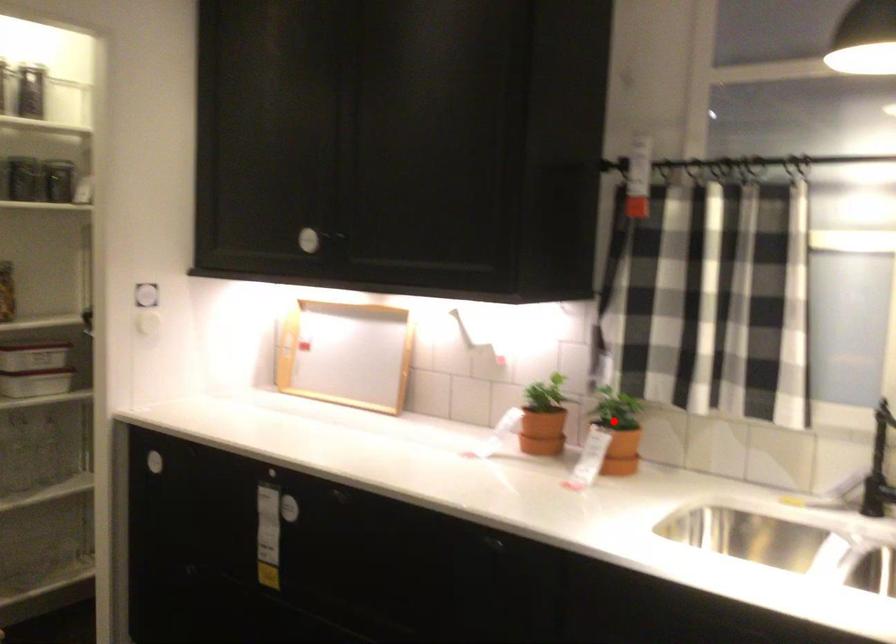
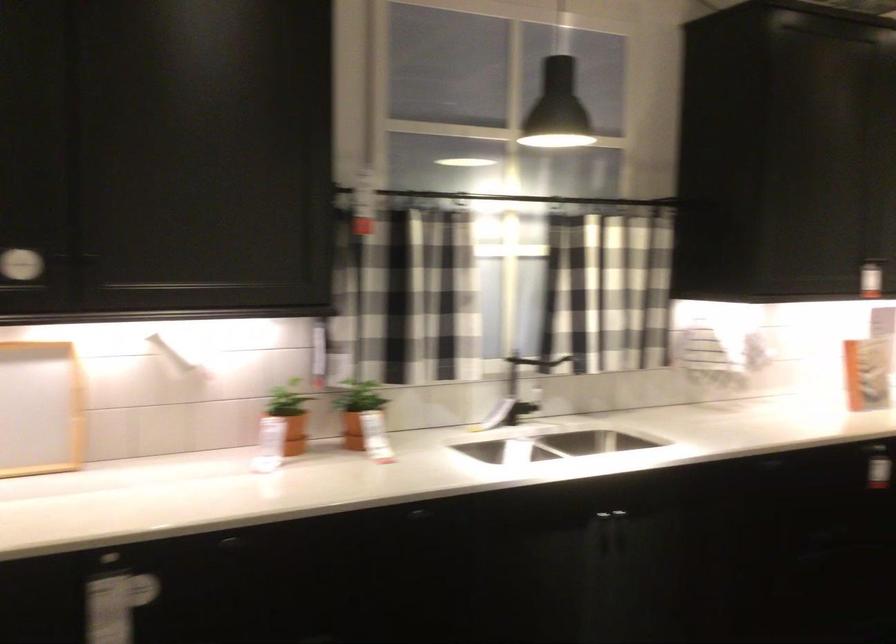
Find the pixel in the second image that matches the highlighted location in the first image.

(357, 410)